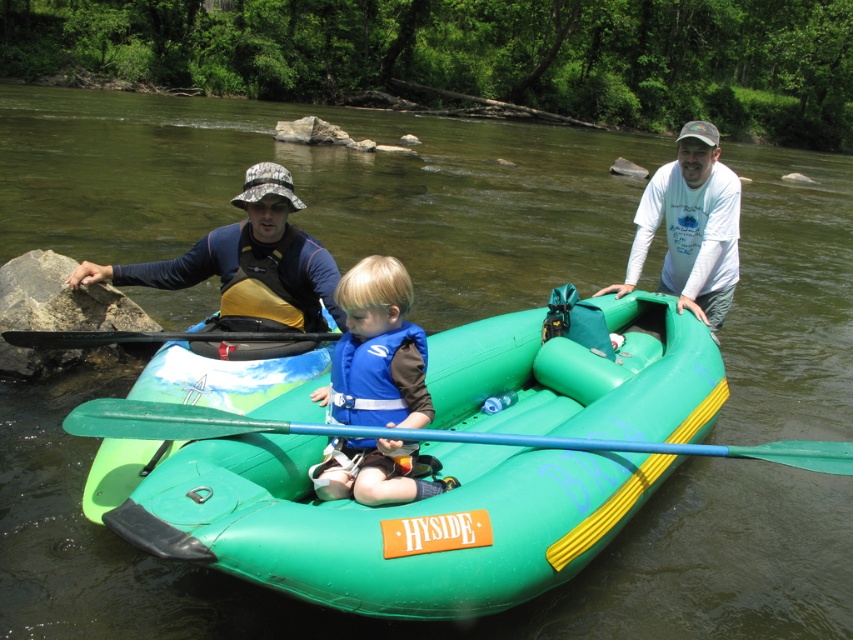
Question: Can you confirm if white long-sleeved shirt at upper right is positioned to the right of black rubber paddle at left?

Choices:
 (A) yes
 (B) no

Answer: (A)

Question: Is green rubber raft at center smaller than green plastic paddle at center?

Choices:
 (A) no
 (B) yes

Answer: (A)

Question: Which point is closer to the camera?

Choices:
 (A) green rubber raft at center
 (B) white long-sleeved shirt at upper right
 (C) blue fabric life vest at center
 (D) green plastic paddle at center

Answer: (A)

Question: Which object appears closest to the camera in this image?

Choices:
 (A) black rubber paddle at left
 (B) white long-sleeved shirt at upper right
 (C) blue fabric life vest at center
 (D) green plastic paddle at center

Answer: (D)

Question: Is blue fabric life vest at center to the left of black rubber paddle at left from the viewer's perspective?

Choices:
 (A) yes
 (B) no

Answer: (B)

Question: Which of the following is the farthest from the observer?

Choices:
 (A) (666, 442)
 (B) (171, 332)

Answer: (B)